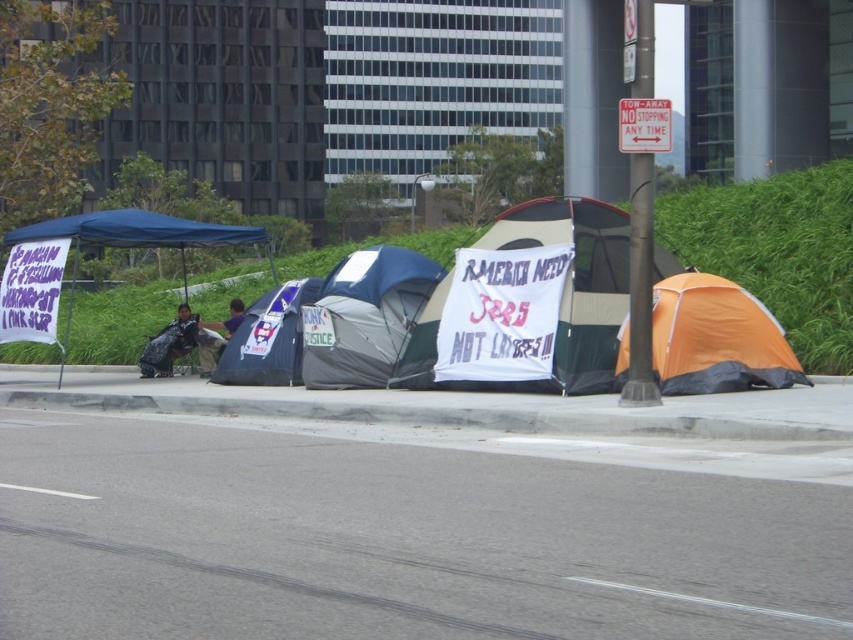
Which is more to the left, gray concrete curb at lower center or blue fabric tent at center?

Result: blue fabric tent at center

Is gray concrete curb at lower center bigger than blue fabric tent at center?

Correct, gray concrete curb at lower center is larger in size than blue fabric tent at center.

Does point (642, 432) lie in front of point (270, 362)?

Yes, it is.

Find the location of a particular element. The width and height of the screenshot is (853, 640). gray concrete curb at lower center is located at coordinates (436, 416).

Who is higher up, gray fabric tent at center or white plastic sign at center?

white plastic sign at center is above.

The width and height of the screenshot is (853, 640). I want to click on gray fabric tent at center, so click(364, 316).

Consider the image. Does white fabric tent at center appear under blue fabric tent at center?

Actually, white fabric tent at center is above blue fabric tent at center.

Can you confirm if white fabric tent at center is shorter than blue fabric tent at center?

In fact, white fabric tent at center may be taller than blue fabric tent at center.

Describe the element at coordinates (560, 298) in the screenshot. This screenshot has width=853, height=640. I see `white fabric tent at center` at that location.

This screenshot has width=853, height=640. In order to click on white fabric tent at center in this screenshot , I will do (560, 298).